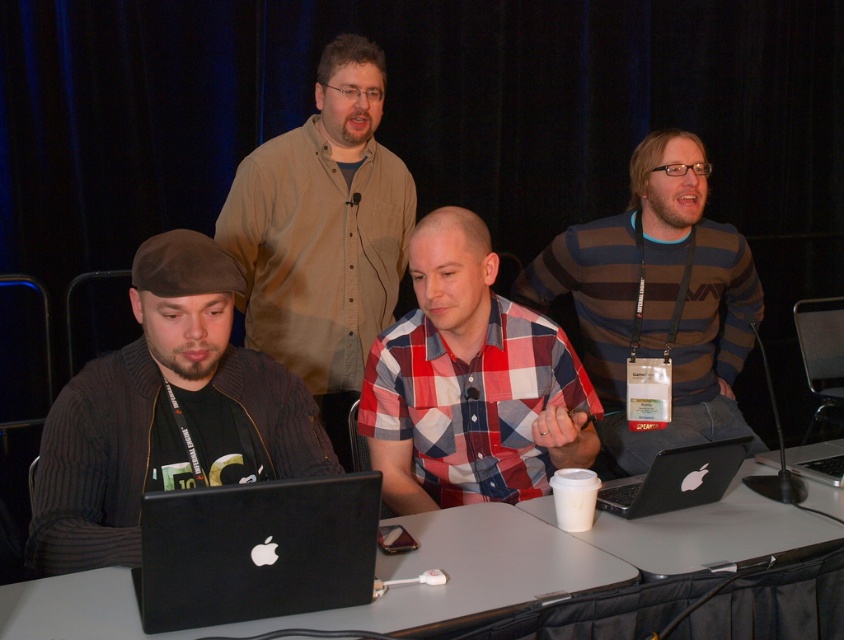
Does striped sweater at center have a smaller size compared to black matte laptop at lower left?

Incorrect, striped sweater at center is not smaller in size than black matte laptop at lower left.

Find the location of a particular element. The image size is (844, 640). striped sweater at center is located at coordinates click(657, 301).

Is black matte laptop at lower left to the left of black plastic laptop at right from the viewer's perspective?

Indeed, black matte laptop at lower left is positioned on the left side of black plastic laptop at right.

Locate an element on the screen. This screenshot has width=844, height=640. black matte laptop at lower left is located at coordinates (257, 550).

Between dark gray knit sweater at left and white plastic table at center, which one has more height?

Standing taller between the two is dark gray knit sweater at left.

Is point (193, 349) positioned in front of point (711, 538)?

Yes, point (193, 349) is closer to viewer.

Does point (122, 445) come in front of point (610, 532)?

Yes.

You are a GUI agent. You are given a task and a screenshot of the screen. Output one action in this format:
    pyautogui.click(x=<x>, y=<y>)
    Task: Click on the dark gray knit sweater at left
    
    Given the screenshot: What is the action you would take?
    pyautogui.click(x=165, y=413)